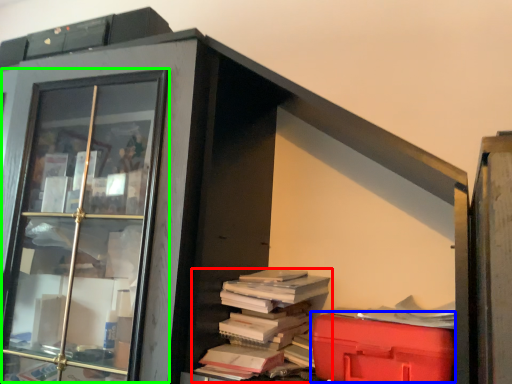
Question: Considering the real-world distances, which object is farthest from book (highlighted by a red box)? waste (highlighted by a blue box) or glass door (highlighted by a green box)?

Choices:
 (A) waste
 (B) glass door

Answer: (B)